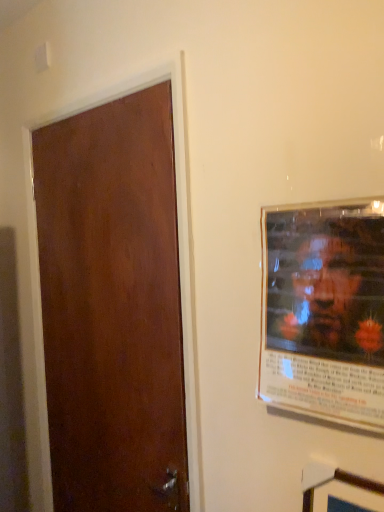
Describe the element at coordinates (324, 310) in the screenshot. I see `metallic glass picture frame at right` at that location.

What are the coordinates of `metallic glass picture frame at right` in the screenshot? It's located at (324, 310).

Find the location of `metallic glass picture frame at right`. metallic glass picture frame at right is located at coordinates (324, 310).